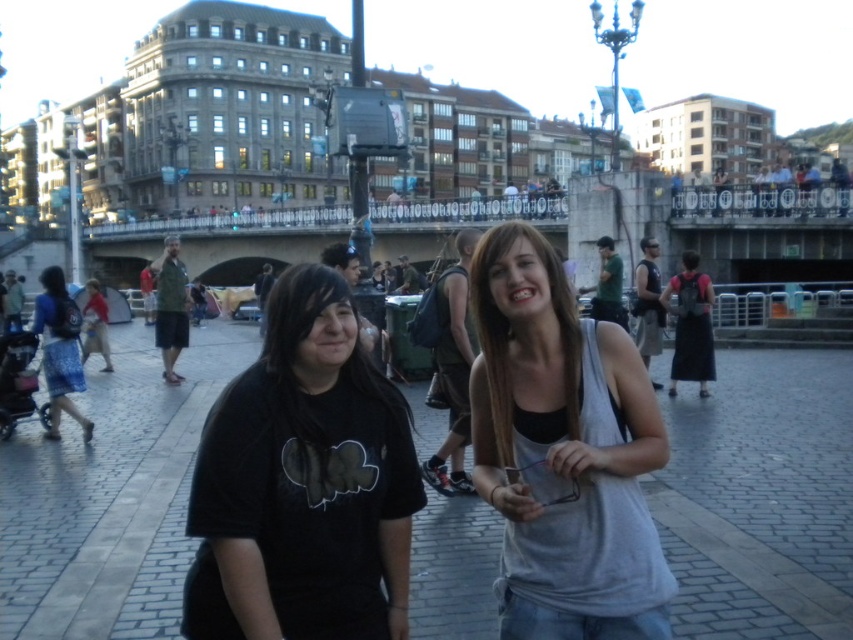
Between black matte shirt at center and gray cotton tank top at center, which one has less height?

Standing shorter between the two is black matte shirt at center.

Is black matte shirt at center smaller than gray cotton tank top at center?

Correct, black matte shirt at center occupies less space than gray cotton tank top at center.

Measure the distance between point (392, 577) and camera.

26.32 meters

Locate an element on the screen. Image resolution: width=853 pixels, height=640 pixels. black matte shirt at center is located at coordinates point(303,483).

Can you confirm if black matte shirt at center is bigger than blue denim skirt at left?

Incorrect, black matte shirt at center is not larger than blue denim skirt at left.

Who is positioned more to the left, black matte shirt at center or blue denim skirt at left?

blue denim skirt at left

Image resolution: width=853 pixels, height=640 pixels. Find the location of `black matte shirt at center`. black matte shirt at center is located at coordinates (303, 483).

Between point (579, 563) and point (64, 282), which one is positioned behind?

The point (64, 282) is more distant.

Is gray cotton tank top at center wider than blue denim skirt at left?

No, gray cotton tank top at center is not wider than blue denim skirt at left.

Does point (535, 276) come closer to viewer compared to point (59, 397)?

Yes, point (535, 276) is closer to viewer.

This screenshot has width=853, height=640. I want to click on gray cotton tank top at center, so click(x=563, y=452).